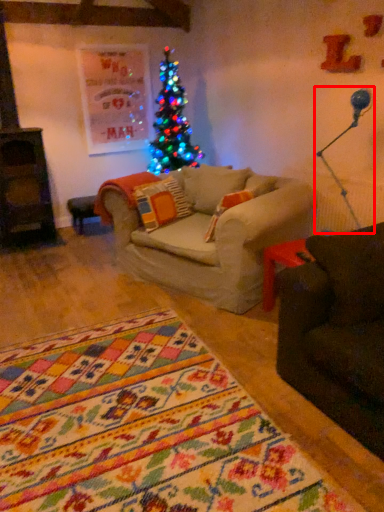
Question: From the image, what is the correct spatial relationship of lamp (annotated by the red box) in relation to pillow?

Choices:
 (A) left
 (B) right

Answer: (B)